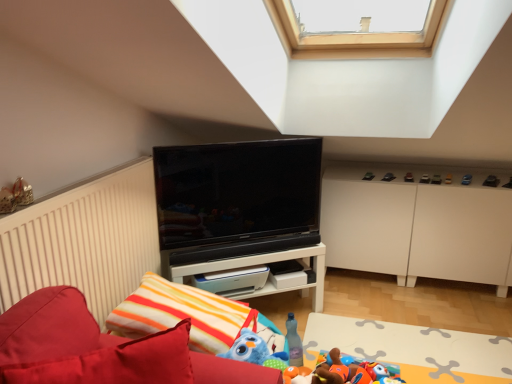
Question: Considering the relative sizes of blue plastic toy at upper right, acting as the fifth toy starting from the top, and white glossy shelf at center in the image provided, is blue plastic toy at upper right, acting as the fifth toy starting from the top, wider than white glossy shelf at center?

Choices:
 (A) no
 (B) yes

Answer: (A)

Question: Is blue plastic toy at upper right, which ranks as the 4th toy in front-to-back order, thinner than white glossy shelf at center?

Choices:
 (A) yes
 (B) no

Answer: (A)

Question: Is blue plastic toy at upper right, the 7th toy in the left-to-right sequence, outside white glossy shelf at center?

Choices:
 (A) yes
 (B) no

Answer: (A)

Question: Considering the relative sizes of blue plastic toy at upper right, the fifth toy when ordered from back to front, and white glossy shelf at center in the image provided, is blue plastic toy at upper right, the fifth toy when ordered from back to front, shorter than white glossy shelf at center?

Choices:
 (A) no
 (B) yes

Answer: (B)

Question: Does blue plastic toy at upper right, acting as the fifth toy starting from the top, contain white glossy shelf at center?

Choices:
 (A) no
 (B) yes

Answer: (A)

Question: From the image's perspective, is white glossy shelf at center above or below white matte cabinet at right?

Choices:
 (A) above
 (B) below

Answer: (B)

Question: Is white glossy shelf at center wider or thinner than white matte cabinet at right?

Choices:
 (A) wide
 (B) thin

Answer: (B)

Question: From a real-world perspective, is white glossy shelf at center above or below white matte cabinet at right?

Choices:
 (A) below
 (B) above

Answer: (A)

Question: Considering the positions of point (173, 273) and point (448, 226), is point (173, 273) closer or farther from the camera than point (448, 226)?

Choices:
 (A) closer
 (B) farther

Answer: (A)

Question: From the image's perspective, relative to black glossy tv at center, is white glossy shelf at center above or below?

Choices:
 (A) below
 (B) above

Answer: (A)

Question: Do you think white glossy shelf at center is within black glossy tv at center, or outside of it?

Choices:
 (A) inside
 (B) outside

Answer: (B)

Question: From a real-world perspective, is white glossy shelf at center above or below black glossy tv at center?

Choices:
 (A) below
 (B) above

Answer: (A)

Question: Based on their sizes in the image, would you say white glossy shelf at center is bigger or smaller than black glossy tv at center?

Choices:
 (A) small
 (B) big

Answer: (B)

Question: Looking at their shapes, would you say matte black toy at upper center, the 8th toy from the bottom, is wider or thinner than black glossy tv at center?

Choices:
 (A) wide
 (B) thin

Answer: (A)

Question: Would you say matte black toy at upper center, which is the third toy in left-to-right order, is to the left or to the right of black glossy tv at center in the picture?

Choices:
 (A) left
 (B) right

Answer: (B)